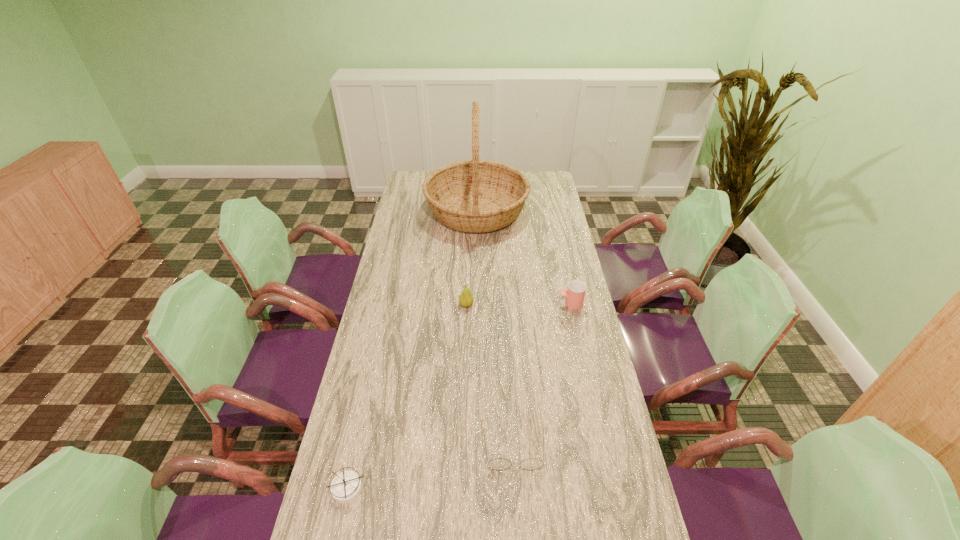
You are a GUI agent. You are given a task and a screenshot of the screen. Output one action in this format:
    pyautogui.click(x=<x>, y=<y>)
    Task: Click on the object that is at the far left corner
    
    Given the screenshot: What is the action you would take?
    pyautogui.click(x=475, y=196)

This screenshot has height=540, width=960. Find the location of `object that is at the far right corner`. object that is at the far right corner is located at coordinates pyautogui.click(x=475, y=196).

Where is `vacant space at the left edge of the desktop`? vacant space at the left edge of the desktop is located at coordinates (388, 249).

In the image, there is a desktop. In order to click on blank space at the right edge in this screenshot , I will do `click(585, 352)`.

Where is `empty location between the pear and the third shortest object`? empty location between the pear and the third shortest object is located at coordinates (518, 304).

Identify the location of vacant region between the fourth tallest object and the cup. (541, 375).

Locate an element on the screen. blank region between the compass and the second shortest object is located at coordinates click(x=431, y=467).

This screenshot has height=540, width=960. What are the coordinates of `free space between the rightmost object and the spectacles` in the screenshot? It's located at (541, 375).

Where is `free space between the compass and the pear`? Image resolution: width=960 pixels, height=540 pixels. free space between the compass and the pear is located at coordinates (407, 396).

Identify the location of empty location between the farthest object and the shortest object. The width and height of the screenshot is (960, 540). (412, 349).